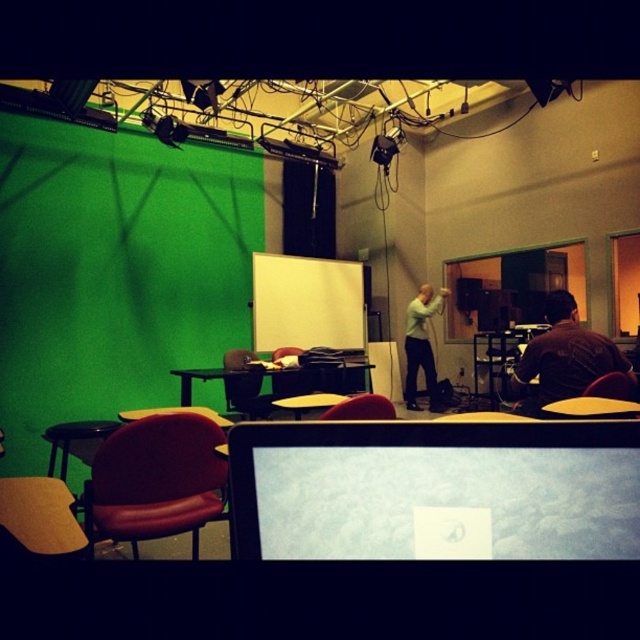
Does matte gray monitor at center lie in front of yellow matte table at center?

Yes, matte gray monitor at center is closer to the viewer.

Is matte gray monitor at center smaller than yellow matte table at center?

Correct, matte gray monitor at center occupies less space than yellow matte table at center.

Measure the distance between point (586, 460) and camera.

A distance of 24.35 inches exists between point (586, 460) and camera.

Find the location of a particular element. The height and width of the screenshot is (640, 640). matte gray monitor at center is located at coordinates (435, 490).

Is leather swivel chair at lower left shorter than matte black chair at center?

No, leather swivel chair at lower left is not shorter than matte black chair at center.

Consider the image. Who is more distant from viewer, (x=218, y=467) or (x=301, y=349)?

Point (x=301, y=349)

Identify the location of leather swivel chair at lower left. The width and height of the screenshot is (640, 640). (156, 481).

Between point (356, 429) and point (84, 509), which one is positioned in front?

Positioned in front is point (356, 429).

Does matte gray monitor at center have a greater height compared to leather swivel chair at lower left?

No, matte gray monitor at center is not taller than leather swivel chair at lower left.

Who is more distant from viewer, (x=454, y=513) or (x=184, y=416)?

Positioned behind is point (x=184, y=416).

This screenshot has height=640, width=640. I want to click on matte gray monitor at center, so click(x=435, y=490).